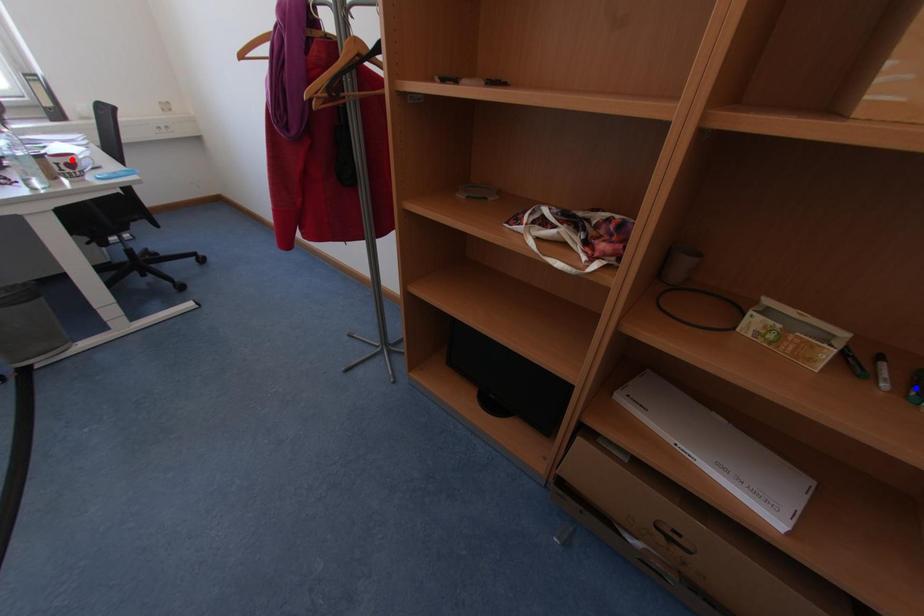
Question: Two points are marked on the image. Which point is closer to the camera?

Choices:
 (A) Blue point is closer.
 (B) Red point is closer.

Answer: (A)